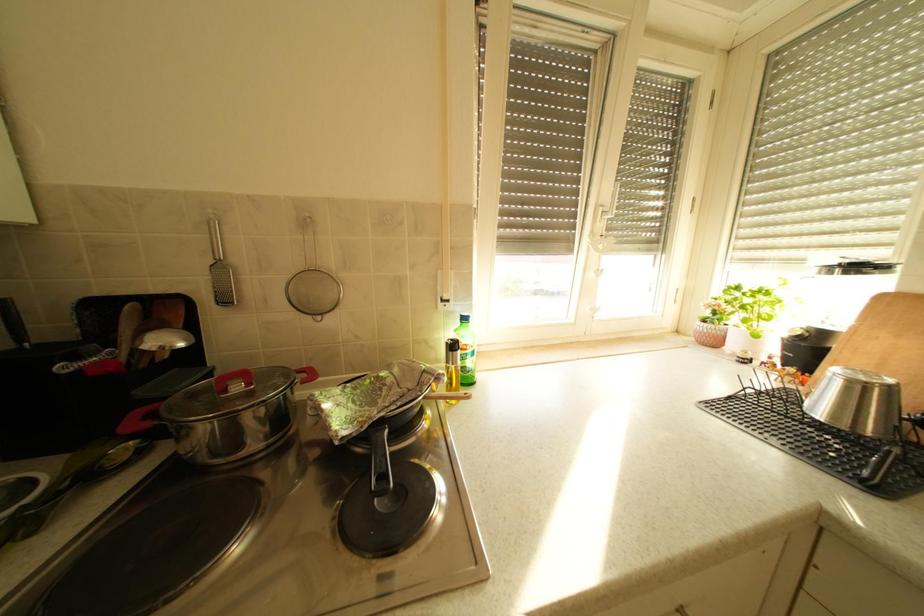
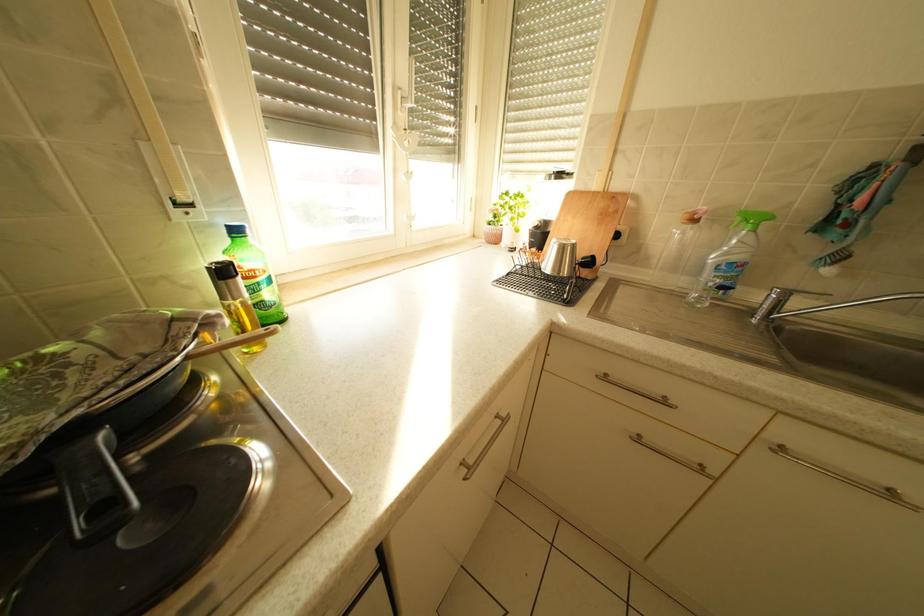
The images are taken continuously from a first-person perspective. In which direction is your viewpoint rotating?

The camera rotated toward right-down.